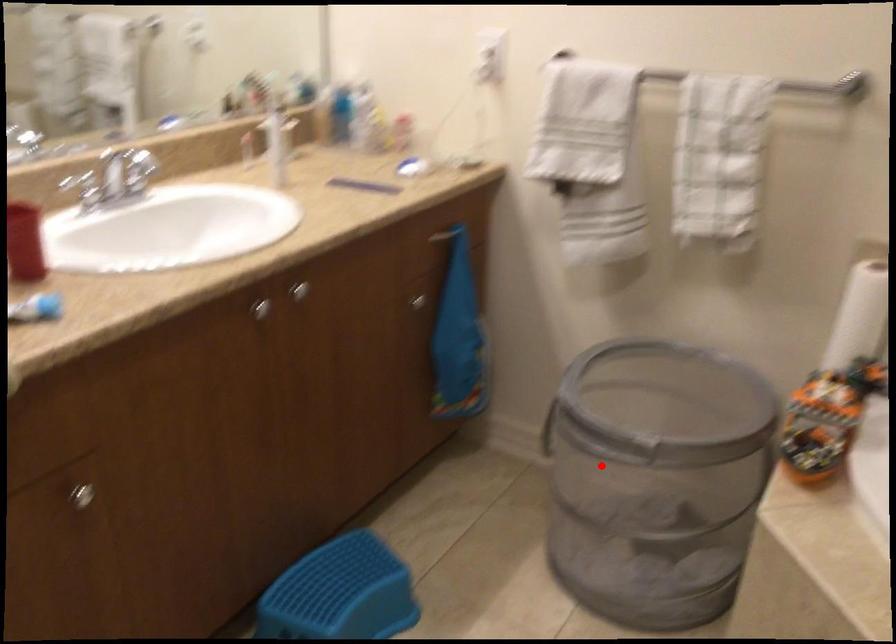
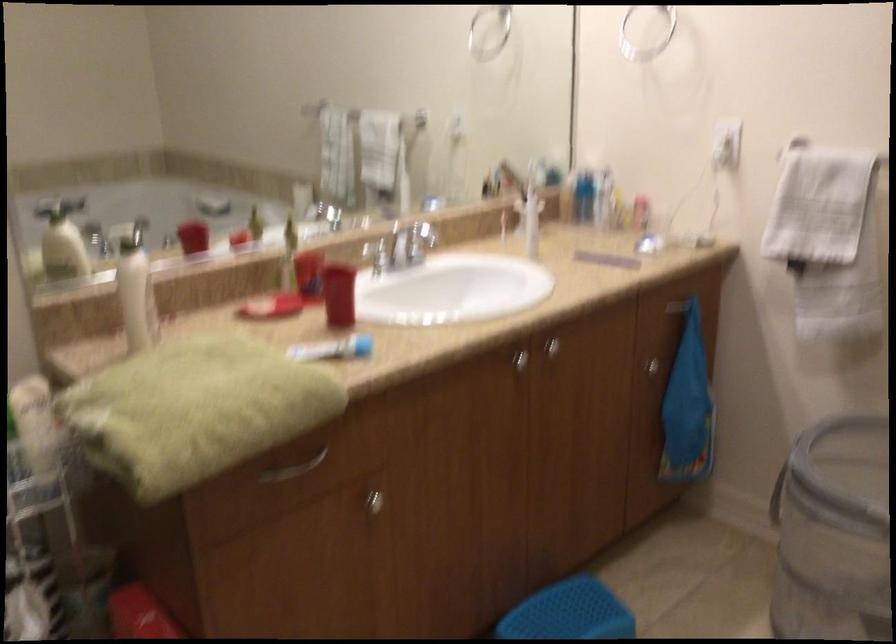
Locate, in the second image, the point that corresponds to the highlighted location in the first image.

(833, 533)